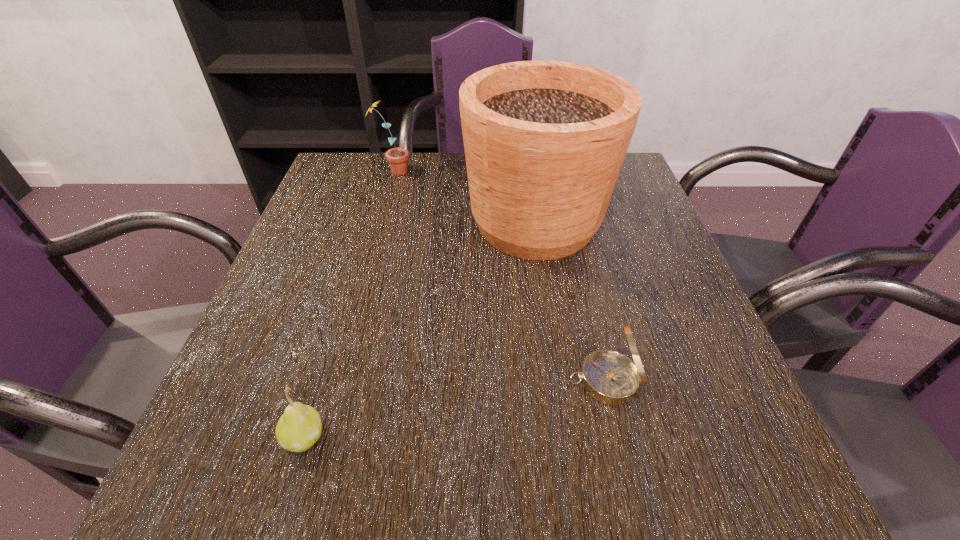
What are the coordinates of `flowerpot` in the screenshot? It's located at (544, 141).

Where is `the tallest object`? The width and height of the screenshot is (960, 540). the tallest object is located at coordinates (544, 141).

Identify the location of sunflower. (397, 157).

Where is `the second tallest object`? This screenshot has height=540, width=960. the second tallest object is located at coordinates (397, 157).

The image size is (960, 540). In order to click on the second nearest object in this screenshot , I will do [610, 377].

In order to click on the nearest object in this screenshot , I will do `click(299, 428)`.

Where is `vacant area situated 0.150m on the left of the flowerpot`? This screenshot has width=960, height=540. vacant area situated 0.150m on the left of the flowerpot is located at coordinates (400, 222).

The height and width of the screenshot is (540, 960). I want to click on vacant region located 0.160m on the flower of the second tallest object, so click(468, 171).

This screenshot has height=540, width=960. In order to click on vacant area located with the dial facing the second nearest object in this screenshot , I will do `click(450, 381)`.

Identify the location of vacant space situated with the dial facing the second nearest object. The width and height of the screenshot is (960, 540). (438, 381).